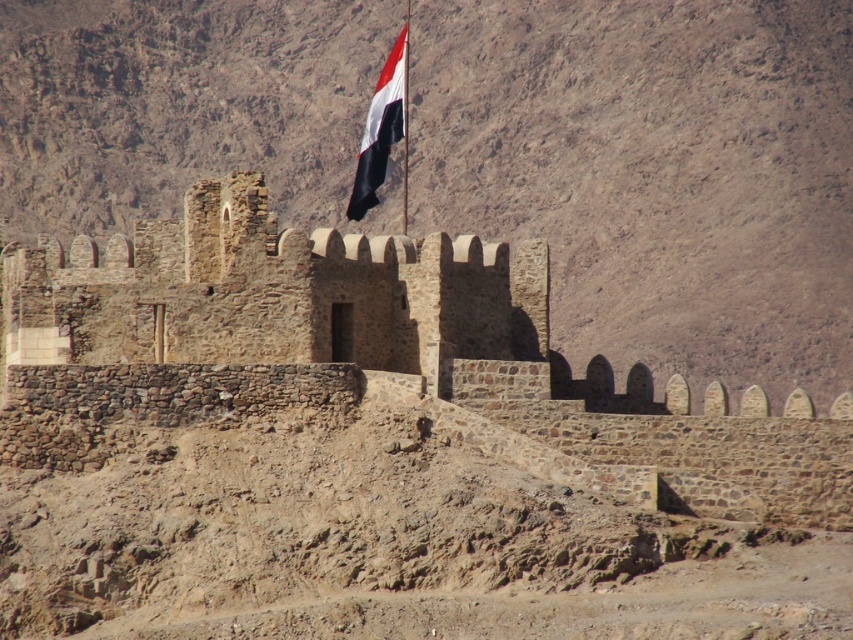
Question: Is brown stone wall at center positioned at the back of rustic stone castle at center?

Choices:
 (A) no
 (B) yes

Answer: (B)

Question: Which object is the closest to the rustic stone castle at center?

Choices:
 (A) brown stone wall at center
 (B) white fabric flag at upper center

Answer: (B)

Question: Can you confirm if brown stone wall at center is positioned to the left of white fabric flag at upper center?

Choices:
 (A) yes
 (B) no

Answer: (B)

Question: Which object is farther from the camera taking this photo?

Choices:
 (A) white fabric flag at upper center
 (B) brown stone wall at center

Answer: (B)

Question: Estimate the real-world distances between objects in this image. Which object is closer to the rustic stone castle at center?

Choices:
 (A) white fabric flag at upper center
 (B) brown stone wall at center

Answer: (A)

Question: Does rustic stone castle at center come behind white fabric flag at upper center?

Choices:
 (A) no
 (B) yes

Answer: (A)